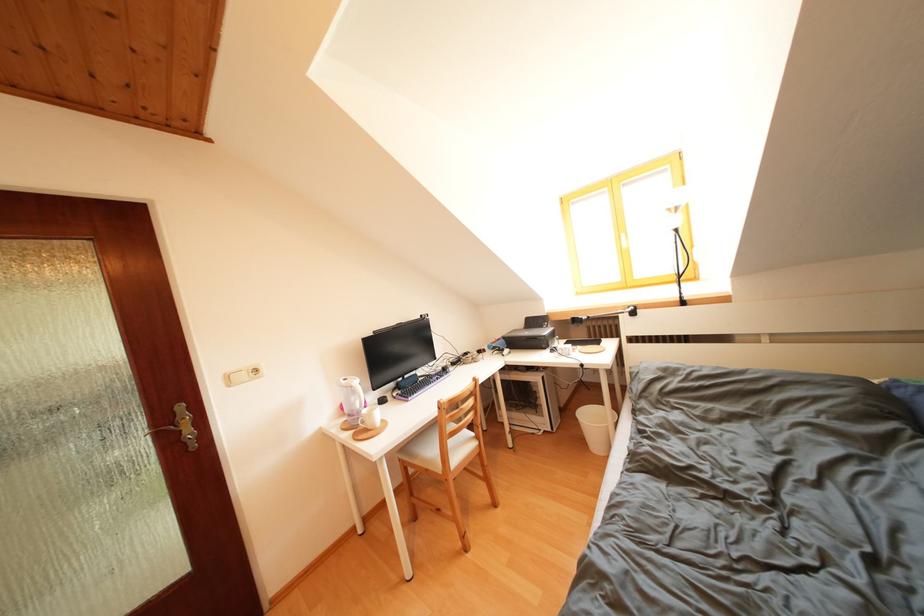
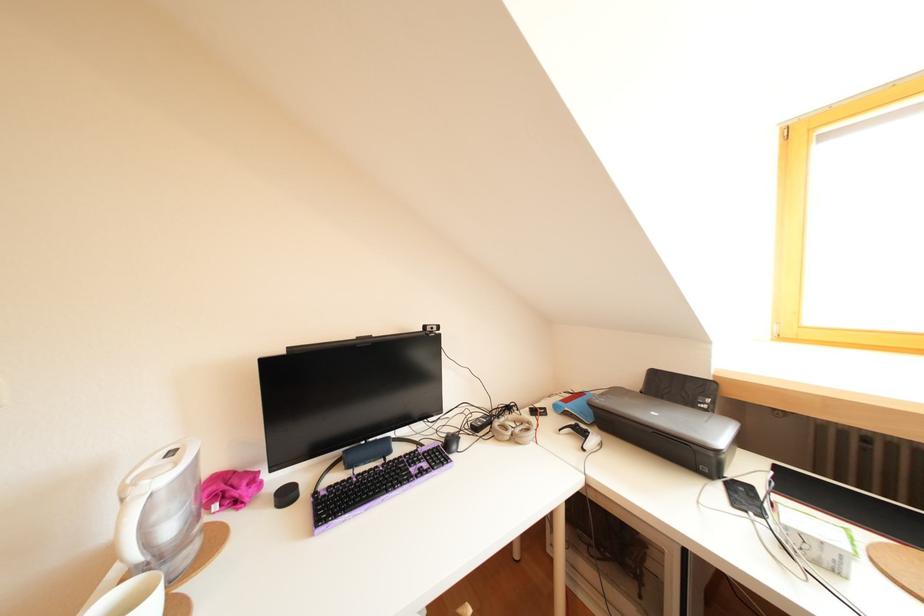
Locate, in the second image, the point that corresponds to point (473, 359) in the first image.

(516, 413)